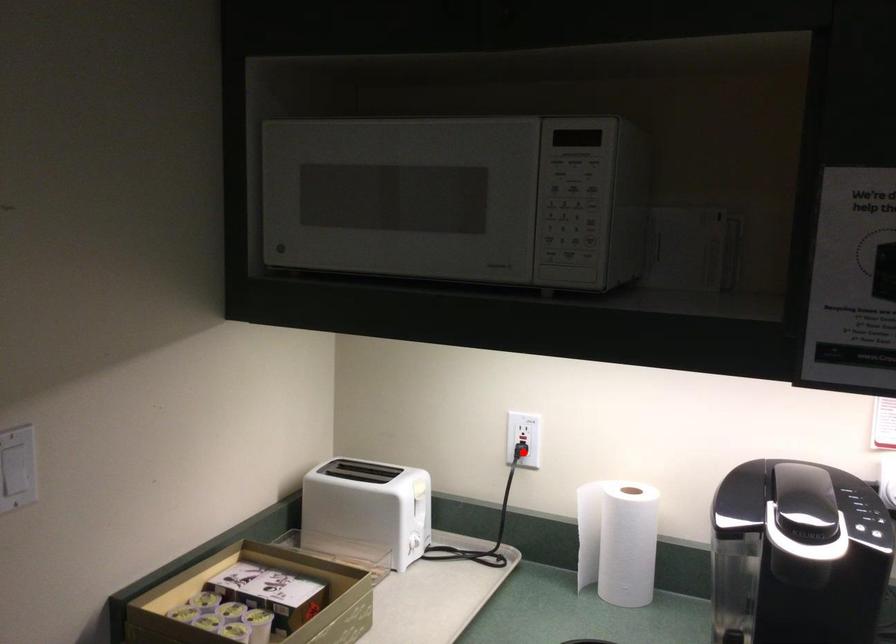
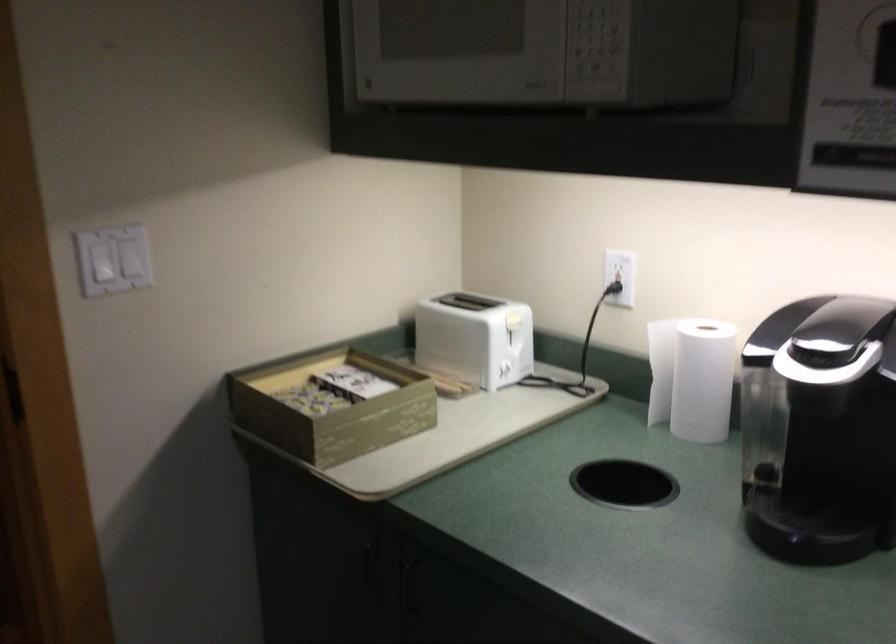
In the second image, find the point that corresponds to the highlighted location in the first image.

(613, 288)